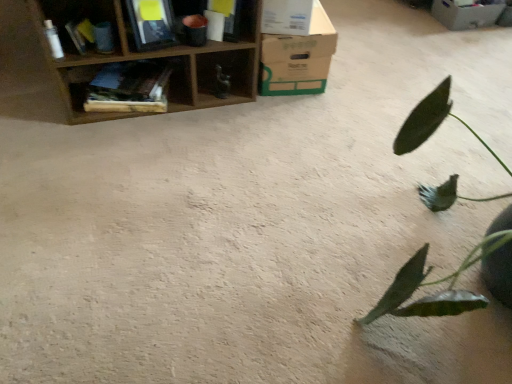
What do you see at coordinates (124, 85) in the screenshot?
I see `wooden bookshelf at upper left, the second shelf when ordered from right to left` at bounding box center [124, 85].

The height and width of the screenshot is (384, 512). Find the location of `wooden shelf at upper left, placed as the first shelf when sorted from right to left`. wooden shelf at upper left, placed as the first shelf when sorted from right to left is located at coordinates (128, 56).

In order to face wooden shelf at upper left, placed as the first shelf when sorted from right to left, should I rotate leftwards or rightwards?

You should look left and rotate roughly 13.105 degrees.

In the scene shown: What is the approximate height of cardboard box at upper right, acting as the 2th cardboard box starting from the front?

cardboard box at upper right, acting as the 2th cardboard box starting from the front, is 14.67 centimeters tall.

The width and height of the screenshot is (512, 384). Describe the element at coordinates (298, 58) in the screenshot. I see `brown cardboard box at upper center, which is counted as the 1th cardboard box, starting from the left` at that location.

Image resolution: width=512 pixels, height=384 pixels. I want to click on wooden bookshelf at upper left, the 1th shelf from the left, so click(x=86, y=25).

From a real-world perspective, is wooden shelf at upper left, which is the third shelf from left to right, physically above wooden bookshelf at upper left, the second shelf when ordered from right to left?

Yes, from a real-world perspective, wooden shelf at upper left, which is the third shelf from left to right, is on top of wooden bookshelf at upper left, the second shelf when ordered from right to left.

Is wooden shelf at upper left, which is the third shelf from left to right, facing away from wooden bookshelf at upper left, which is the second shelf in left-to-right order?

That's right, wooden shelf at upper left, which is the third shelf from left to right, is facing away from wooden bookshelf at upper left, which is the second shelf in left-to-right order.

Between wooden shelf at upper left, which is the third shelf from left to right, and wooden bookshelf at upper left, the second shelf when ordered from right to left, which one has larger size?

With larger size is wooden shelf at upper left, which is the third shelf from left to right.

Which point is more distant from viewer, [84,62] or [115,64]?

The point [115,64] is farther.

From the picture: Between wooden bookshelf at upper left, the 1th shelf from the left, and green matte leafy plant at right, which one appears on the right side from the viewer's perspective?

Positioned to the right is green matte leafy plant at right.

Consider the image. From the image's perspective, does wooden bookshelf at upper left, the 3th shelf when ordered from right to left, appear higher than green matte leafy plant at right?

Indeed, from the image's perspective, wooden bookshelf at upper left, the 3th shelf when ordered from right to left, is shown above green matte leafy plant at right.

From a real-world perspective, is wooden bookshelf at upper left, the 1th shelf from the left, on top of green matte leafy plant at right?

Indeed, from a real-world perspective, wooden bookshelf at upper left, the 1th shelf from the left, stands above green matte leafy plant at right.

Looking at this image, could you tell me if brown cardboard box at upper center, the 1th cardboard box ordered from the bottom, is turned towards green matte leafy plant at right?

No, brown cardboard box at upper center, the 1th cardboard box ordered from the bottom, is not turned towards green matte leafy plant at right.

Who is more distant, brown cardboard box at upper center, positioned as the second cardboard box in right-to-left order, or green matte leafy plant at right?

Positioned behind is brown cardboard box at upper center, positioned as the second cardboard box in right-to-left order.

From a real-world perspective, is brown cardboard box at upper center, which appears as the first cardboard box when viewed from the front, positioned over green matte leafy plant at right based on gravity?

Incorrect, from a real-world perspective, brown cardboard box at upper center, which appears as the first cardboard box when viewed from the front, is lower than green matte leafy plant at right.

Consider the image. Which is more to the left, green matte leafy plant at right or wooden shelf at upper left, which is the third shelf from left to right?

wooden shelf at upper left, which is the third shelf from left to right, is more to the left.

Considering the sizes of green matte leafy plant at right and wooden shelf at upper left, placed as the first shelf when sorted from right to left, in the image, is green matte leafy plant at right bigger or smaller than wooden shelf at upper left, placed as the first shelf when sorted from right to left,?

green matte leafy plant at right is bigger than wooden shelf at upper left, placed as the first shelf when sorted from right to left.

I want to click on the 1st shelf behind the green matte leafy plant at right, so click(128, 56).

From the image's perspective, does green matte leafy plant at right appear higher than wooden shelf at upper left, placed as the first shelf when sorted from right to left?

No.

From a real-world perspective, is green matte leafy plant at right under wooden bookshelf at upper left, which is the second shelf in left-to-right order?

Actually, green matte leafy plant at right is physically above wooden bookshelf at upper left, which is the second shelf in left-to-right order, in the real world.

Which is more to the right, green matte leafy plant at right or wooden bookshelf at upper left, the second shelf when ordered from right to left?

green matte leafy plant at right is more to the right.

How many degrees apart are the facing directions of green matte leafy plant at right and wooden bookshelf at upper left, the second shelf when ordered from right to left?

70.8 degrees separate the facing orientations of green matte leafy plant at right and wooden bookshelf at upper left, the second shelf when ordered from right to left.

Which is in front, green matte leafy plant at right or wooden bookshelf at upper left, which is the second shelf in left-to-right order?

green matte leafy plant at right is in front.

Consider the image. Considering the relative sizes of brown cardboard box at upper center, which is the 2th cardboard box from back to front, and wooden bookshelf at upper left, the second shelf when ordered from right to left, in the image provided, is brown cardboard box at upper center, which is the 2th cardboard box from back to front, smaller than wooden bookshelf at upper left, the second shelf when ordered from right to left,?

Actually, brown cardboard box at upper center, which is the 2th cardboard box from back to front, might be larger than wooden bookshelf at upper left, the second shelf when ordered from right to left.

What's the angular difference between brown cardboard box at upper center, which is the 2th cardboard box from back to front, and wooden bookshelf at upper left, which is the second shelf in left-to-right order,'s facing directions?

They differ by 98.3 degrees in their facing directions.

Which object is thinner, brown cardboard box at upper center, the 1th cardboard box ordered from the bottom, or wooden bookshelf at upper left, the second shelf when ordered from right to left?

Thinner between the two is wooden bookshelf at upper left, the second shelf when ordered from right to left.

From the image's perspective, between brown cardboard box at upper center, which is counted as the 1th cardboard box, starting from the left, and wooden bookshelf at upper left, the second shelf when ordered from right to left, who is located below?

From the image's view, wooden bookshelf at upper left, the second shelf when ordered from right to left, is below.

Does point (394, 297) appear closer or farther from the camera than point (325, 46)?

Point (394, 297).

Is green matte leafy plant at right not within brown cardboard box at upper center, which is the 2th cardboard box from back to front?

Yes, green matte leafy plant at right is outside of brown cardboard box at upper center, which is the 2th cardboard box from back to front.

Consider the image. Considering the sizes of objects green matte leafy plant at right and brown cardboard box at upper center, which appears as the first cardboard box when viewed from the front, in the image provided, who is smaller, green matte leafy plant at right or brown cardboard box at upper center, which appears as the first cardboard box when viewed from the front,?

brown cardboard box at upper center, which appears as the first cardboard box when viewed from the front, is smaller.

Looking at this image, are green matte leafy plant at right and brown cardboard box at upper center, which is counted as the 1th cardboard box, starting from the left, far apart?

green matte leafy plant at right is actually quite close to brown cardboard box at upper center, which is counted as the 1th cardboard box, starting from the left.

Where is `shelf that is on the right side of wooden bookshelf at upper left, the second shelf when ordered from right to left`? shelf that is on the right side of wooden bookshelf at upper left, the second shelf when ordered from right to left is located at coordinates (128, 56).

From the green matte leafy plant at right, count the 3rd shelf to the left and point to it. Please provide its 2D coordinates.

[(86, 25)]

When comparing their distances from green matte leafy plant at right, does wooden bookshelf at upper left, the 1th shelf from the left, or cardboard box at upper right, acting as the 2th cardboard box starting from the bottom, seem further?

cardboard box at upper right, acting as the 2th cardboard box starting from the bottom, lies further to green matte leafy plant at right than the other object.

Estimate the real-world distances between objects in this image. Which object is further from wooden bookshelf at upper left, which is the second shelf in left-to-right order, cardboard box at upper right, arranged as the 1th cardboard box when viewed from the back, or brown cardboard box at upper center, positioned as the second cardboard box in right-to-left order?

Among the two, cardboard box at upper right, arranged as the 1th cardboard box when viewed from the back, is located further to wooden bookshelf at upper left, which is the second shelf in left-to-right order.

Which object lies nearer to the anchor point wooden bookshelf at upper left, the second shelf when ordered from right to left, wooden bookshelf at upper left, the 3th shelf when ordered from right to left, or brown cardboard box at upper center, positioned as the second cardboard box in right-to-left order?

wooden bookshelf at upper left, the 3th shelf when ordered from right to left.

From the image, which object appears to be farther from brown cardboard box at upper center, which is the 2th cardboard box from back to front, wooden bookshelf at upper left, which is the second shelf in left-to-right order, or green matte leafy plant at right?

green matte leafy plant at right is further to brown cardboard box at upper center, which is the 2th cardboard box from back to front.

Looking at the image, which one is located further to wooden bookshelf at upper left, which is the second shelf in left-to-right order, wooden shelf at upper left, which is the third shelf from left to right, or brown cardboard box at upper center, which appears as the first cardboard box when viewed from the front?

Among the two, brown cardboard box at upper center, which appears as the first cardboard box when viewed from the front, is located further to wooden bookshelf at upper left, which is the second shelf in left-to-right order.

Estimate the real-world distances between objects in this image. Which object is further from brown cardboard box at upper center, which appears as the first cardboard box when viewed from the front, wooden bookshelf at upper left, the 3th shelf when ordered from right to left, or wooden shelf at upper left, placed as the first shelf when sorted from right to left?

The object further to brown cardboard box at upper center, which appears as the first cardboard box when viewed from the front, is wooden bookshelf at upper left, the 3th shelf when ordered from right to left.

Looking at the image, which one is located further to green matte leafy plant at right, brown cardboard box at upper center, positioned as the second cardboard box in right-to-left order, or wooden shelf at upper left, placed as the first shelf when sorted from right to left?

Among the two, wooden shelf at upper left, placed as the first shelf when sorted from right to left, is located further to green matte leafy plant at right.

Looking at the image, which one is located closer to cardboard box at upper right, acting as the 2th cardboard box starting from the bottom, brown cardboard box at upper center, the 1th cardboard box ordered from the bottom, or wooden shelf at upper left, which is the third shelf from left to right?

brown cardboard box at upper center, the 1th cardboard box ordered from the bottom, lies closer to cardboard box at upper right, acting as the 2th cardboard box starting from the bottom, than the other object.

This screenshot has width=512, height=384. Find the location of `cardboard box located between wooden bookshelf at upper left, the 1th shelf from the left, and cardboard box at upper right, positioned as the first cardboard box in right-to-left order, in the left-right direction`. cardboard box located between wooden bookshelf at upper left, the 1th shelf from the left, and cardboard box at upper right, positioned as the first cardboard box in right-to-left order, in the left-right direction is located at coordinates (298, 58).

The width and height of the screenshot is (512, 384). What are the coordinates of `houseplant located between wooden bookshelf at upper left, the 1th shelf from the left, and cardboard box at upper right, the first cardboard box positioned from the top, in the left-right direction` in the screenshot? It's located at (x=434, y=284).

Where is `shelf between wooden bookshelf at upper left, which is the second shelf in left-to-right order, and cardboard box at upper right, acting as the 2th cardboard box starting from the front`? The height and width of the screenshot is (384, 512). shelf between wooden bookshelf at upper left, which is the second shelf in left-to-right order, and cardboard box at upper right, acting as the 2th cardboard box starting from the front is located at coordinates (128, 56).

Identify the location of cardboard box located between wooden bookshelf at upper left, the 1th shelf from the left, and green matte leafy plant at right in the left-right direction. (298, 58).